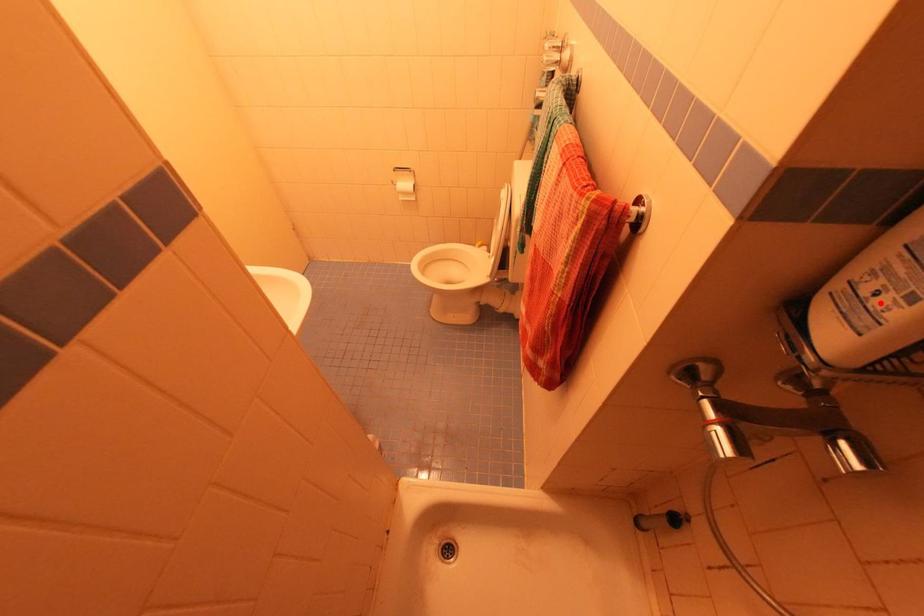
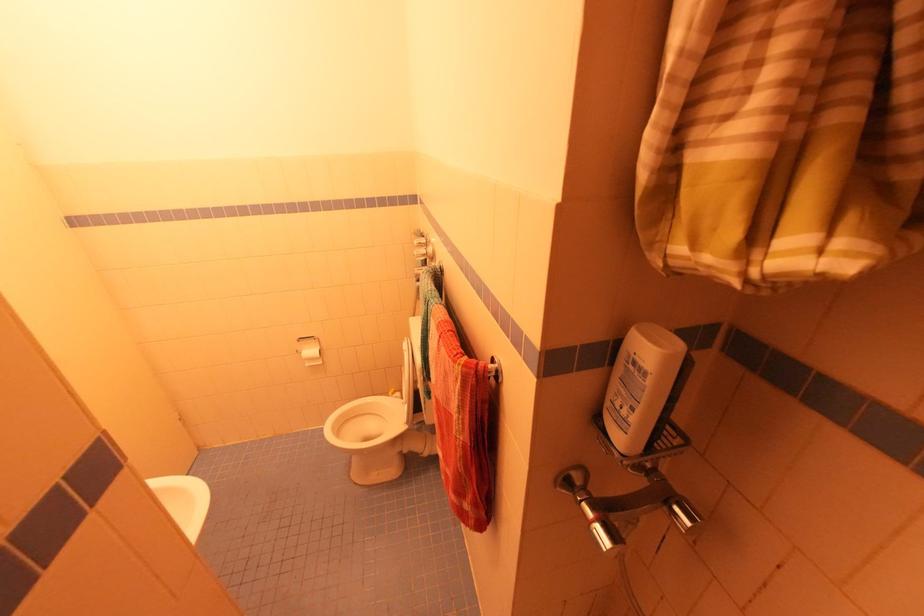
In the second image, find the point that corresponds to the highlighted location in the first image.

(626, 413)